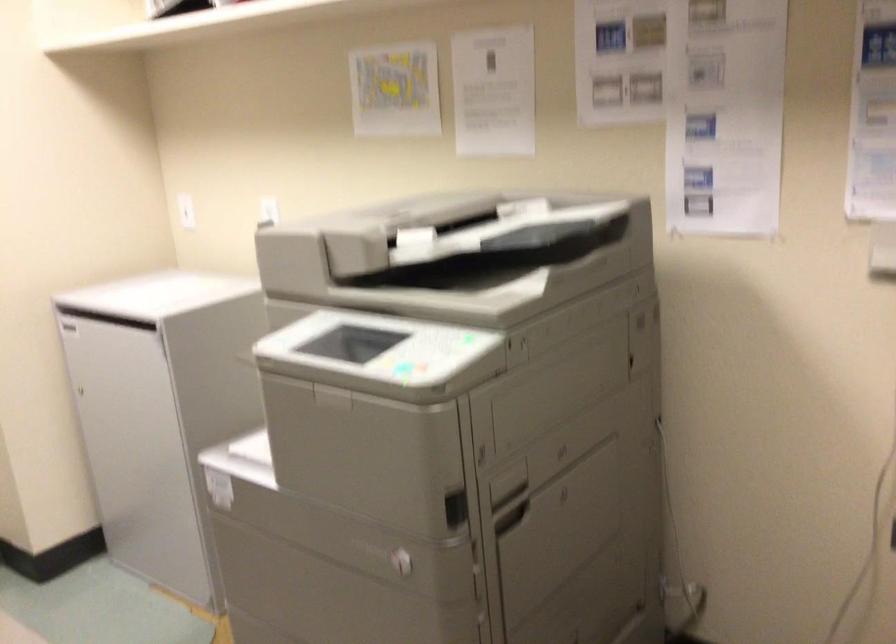
Where would you lift the printer scanner lid? Please return your answer as a coordinate pair (x, y).

(351, 343)